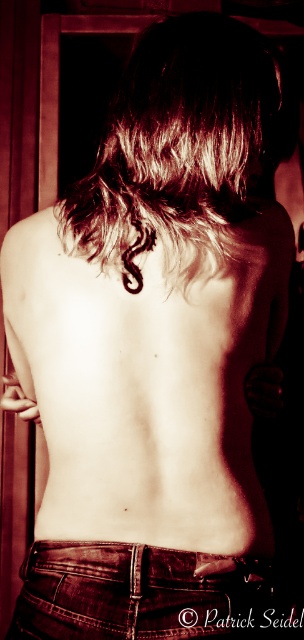
Question: From the image, what is the correct spatial relationship of dark brown wavy hair at center in relation to jeans at lower center?

Choices:
 (A) above
 (B) below

Answer: (A)

Question: Does dark brown wavy hair at center appear under jeans at lower center?

Choices:
 (A) yes
 (B) no

Answer: (B)

Question: Which of the following is the farthest from the observer?

Choices:
 (A) dark brown wavy hair at center
 (B) jeans at lower center

Answer: (A)

Question: Among these objects, which one is nearest to the camera?

Choices:
 (A) jeans at lower center
 (B) dark brown wavy hair at center

Answer: (A)

Question: Is dark brown wavy hair at center below jeans at lower center?

Choices:
 (A) no
 (B) yes

Answer: (A)